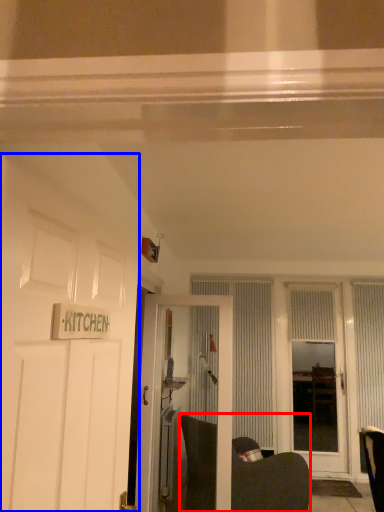
Question: Which object appears farthest to the camera in this image, swivel chair (highlighted by a red box) or door (highlighted by a blue box)?

Choices:
 (A) swivel chair
 (B) door

Answer: (A)